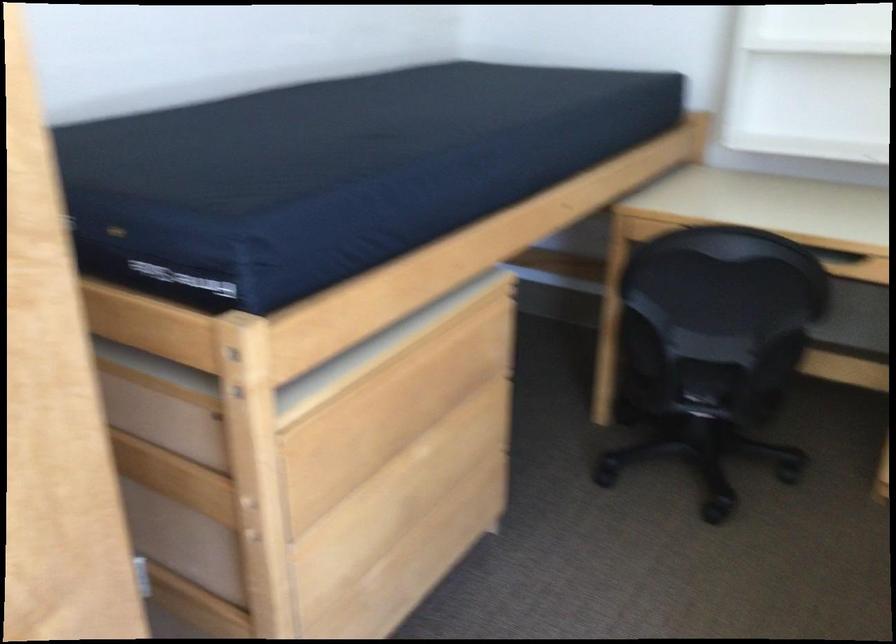
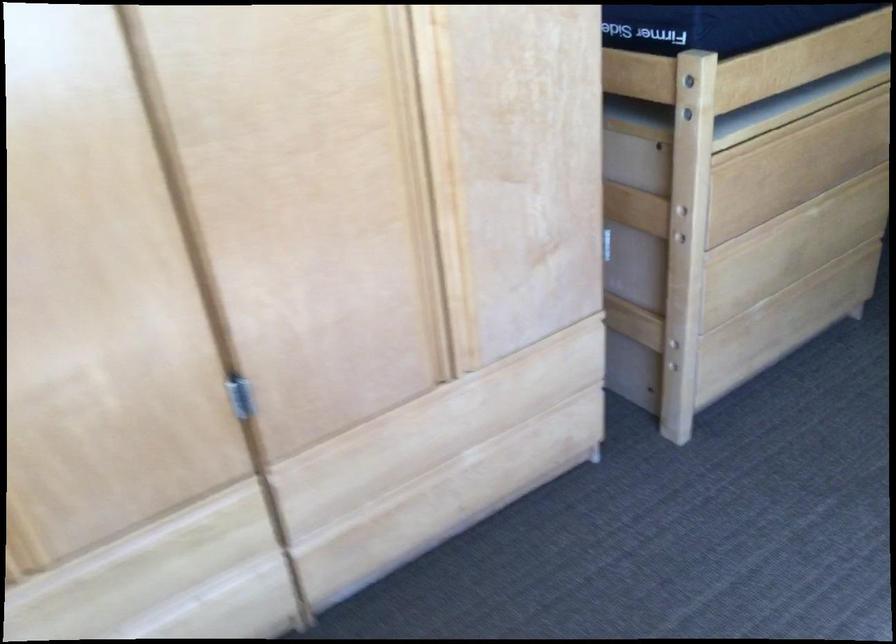
The images are taken continuously from a first-person perspective. In which direction are you moving?

The cameraman walked toward left, backward.